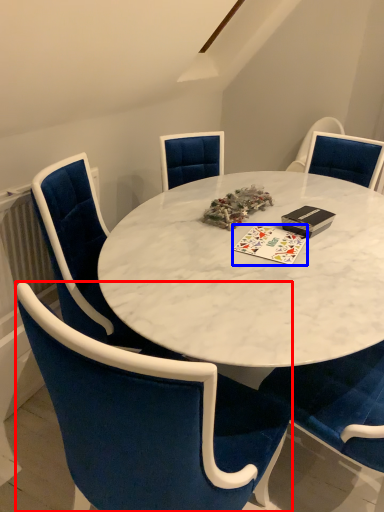
Question: Which of the following is the farthest to the observer, chair (highlighted by a red box) or card game (highlighted by a blue box)?

Choices:
 (A) chair
 (B) card game

Answer: (B)